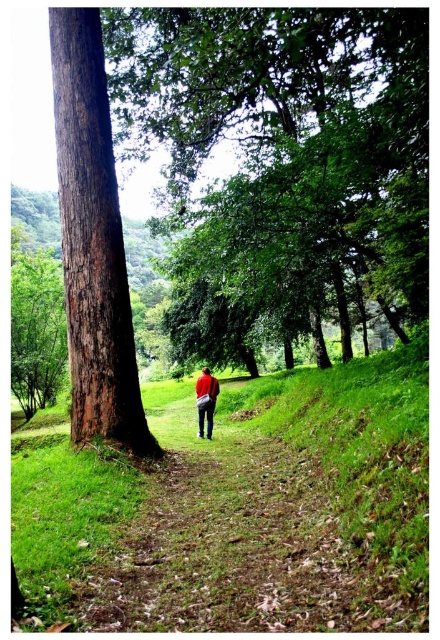
The width and height of the screenshot is (440, 640). What do you see at coordinates (92, 243) in the screenshot?
I see `brown rough bark tree at left` at bounding box center [92, 243].

Image resolution: width=440 pixels, height=640 pixels. Describe the element at coordinates (92, 243) in the screenshot. I see `brown rough bark tree at left` at that location.

Locate an element on the screen. This screenshot has width=440, height=640. brown rough bark tree at left is located at coordinates (92, 243).

Consider the image. Who is shorter, brown rough bark tree at left or red fabric backpack at center?

red fabric backpack at center is shorter.

Between point (103, 138) and point (209, 429), which one is positioned in front?

Point (103, 138)

Where is `brown rough bark tree at left`? brown rough bark tree at left is located at coordinates (92, 243).

Between brown rough tree at center and brown rough bark tree at left, which one is positioned lower?

brown rough bark tree at left

Is brown rough tree at center closer to camera compared to brown rough bark tree at left?

No, it is not.

Is point (330, 227) closer to viewer compared to point (72, 433)?

No.

Where is `brown rough tree at center`? The height and width of the screenshot is (640, 440). brown rough tree at center is located at coordinates (286, 141).